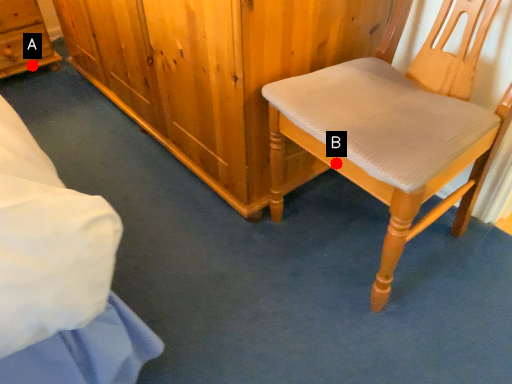
Question: Two points are circled on the image, labeled by A and B beside each circle. Which point is closer to the camera?

Choices:
 (A) A is closer
 (B) B is closer

Answer: (B)